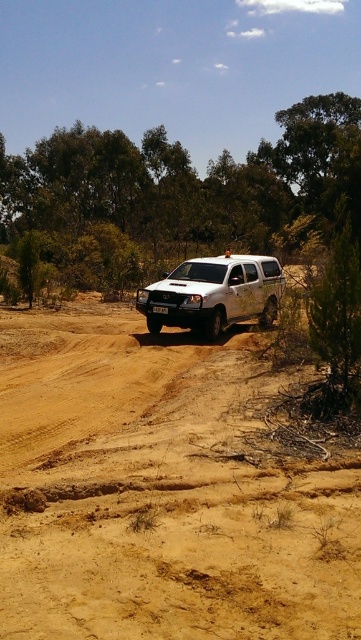
Who is positioned more to the right, brown sandy terrain at center or green leafy tree at center?

brown sandy terrain at center is more to the right.

Which of these two, brown sandy terrain at center or green leafy tree at center, stands taller?

green leafy tree at center is taller.

Measure the distance between point [285,632] and camera.

Point [285,632] and camera are 12.51 feet apart from each other.

I want to click on brown sandy terrain at center, so click(x=161, y=490).

Can you confirm if brown sandy terrain at center is wider than white matte suv at center?

Yes, brown sandy terrain at center is wider than white matte suv at center.

The height and width of the screenshot is (640, 361). I want to click on brown sandy terrain at center, so click(161, 490).

Find the location of `green leafy tree at center`. green leafy tree at center is located at coordinates (183, 189).

Does green leafy tree at center have a lesser width compared to white matte suv at center?

No, green leafy tree at center is not thinner than white matte suv at center.

Who is more forward, (127,186) or (146,308)?

Positioned in front is point (146,308).

Identify the location of green leafy tree at center. (183, 189).